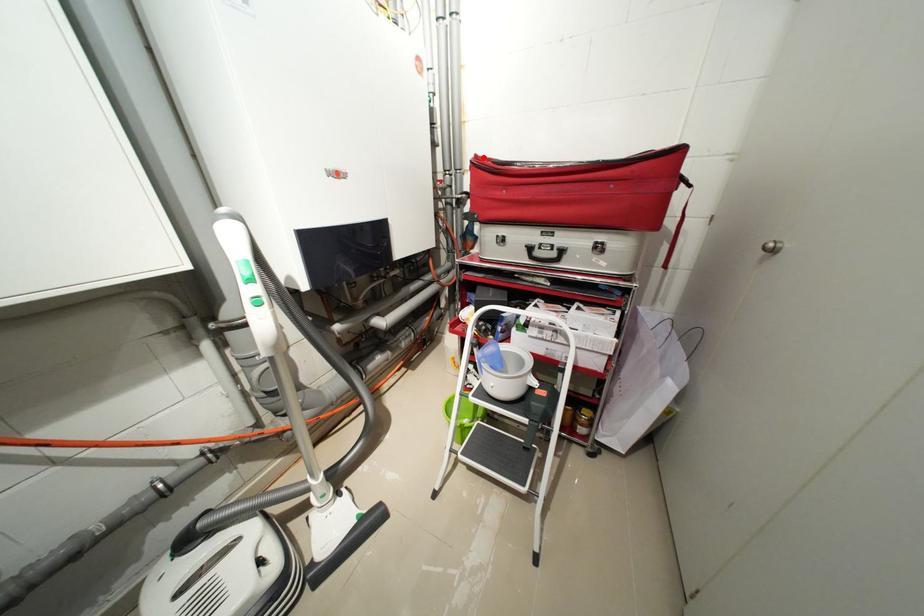
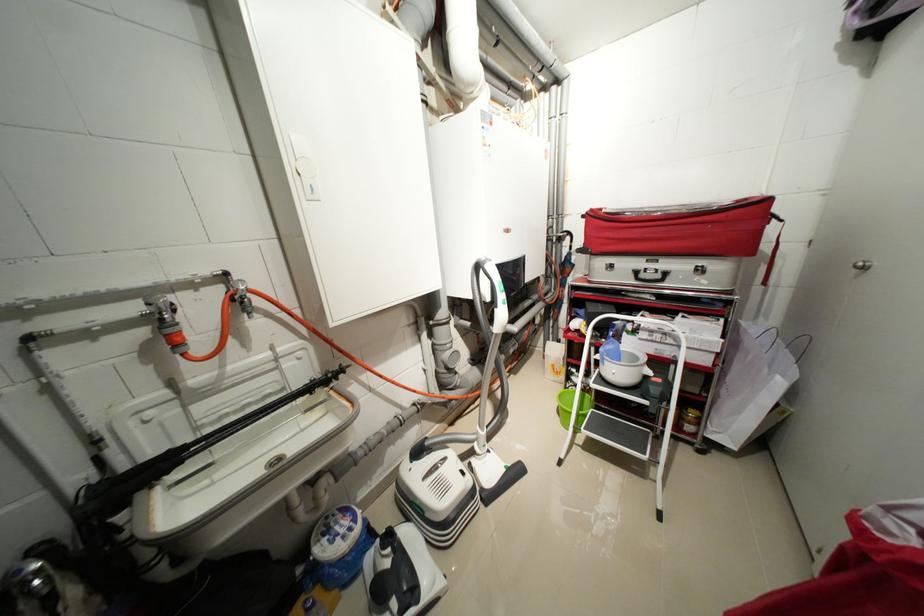
In the second image, find the point that corresponds to the highlighted location in the first image.

(599, 211)